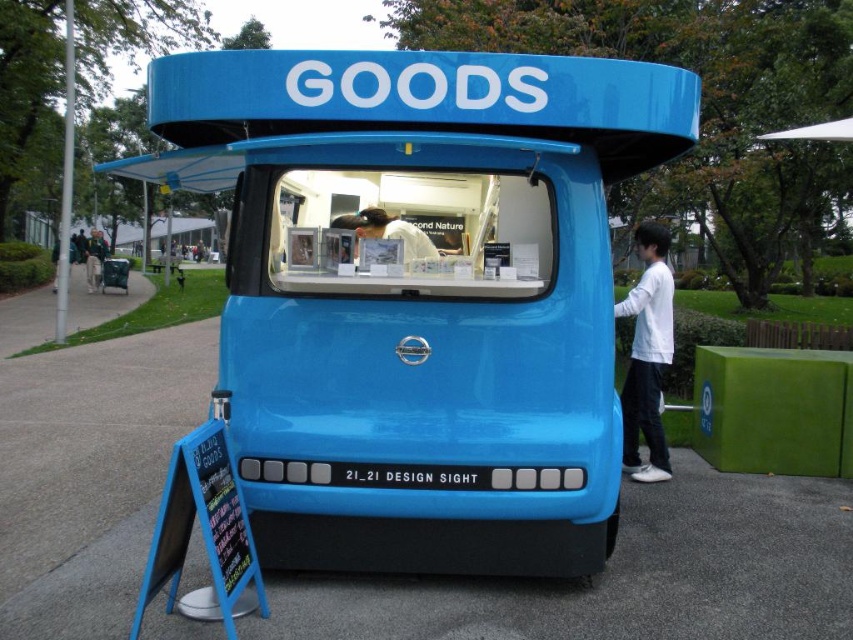
Looking at this image, you are a visitor at a park and see the blue glossy truck at center and the light brown wooden bench at lower left. Which object is closer to you?

The blue glossy truck at center is closer to you because it is in front of the light brown wooden bench at lower left.

You are standing in a park and see a blue vehicle labeled GOODS parked in the center. There is a point marked at coordinates (x=421, y=296). What object is located at this point?

The point at coordinates (x=421, y=296) marks the blue glossy truck at center.